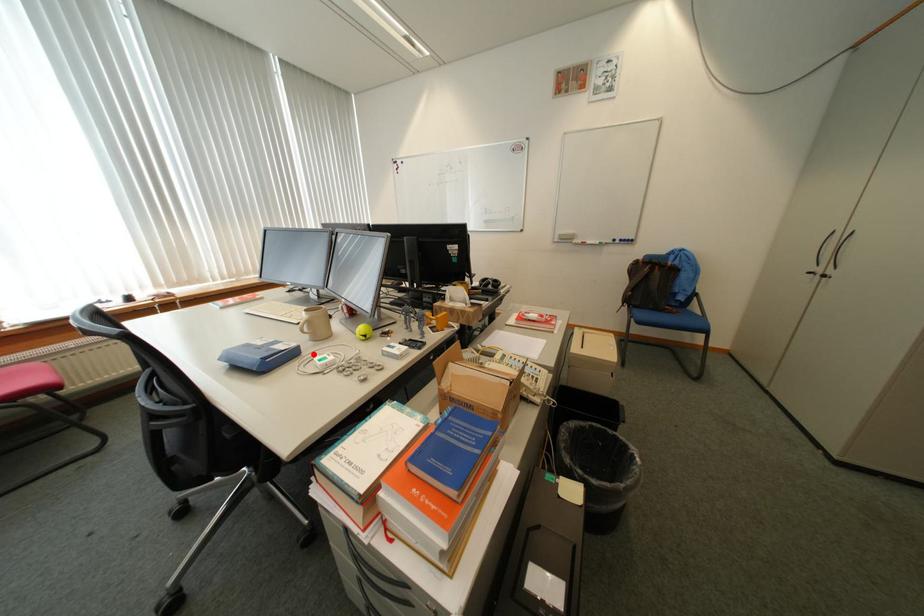
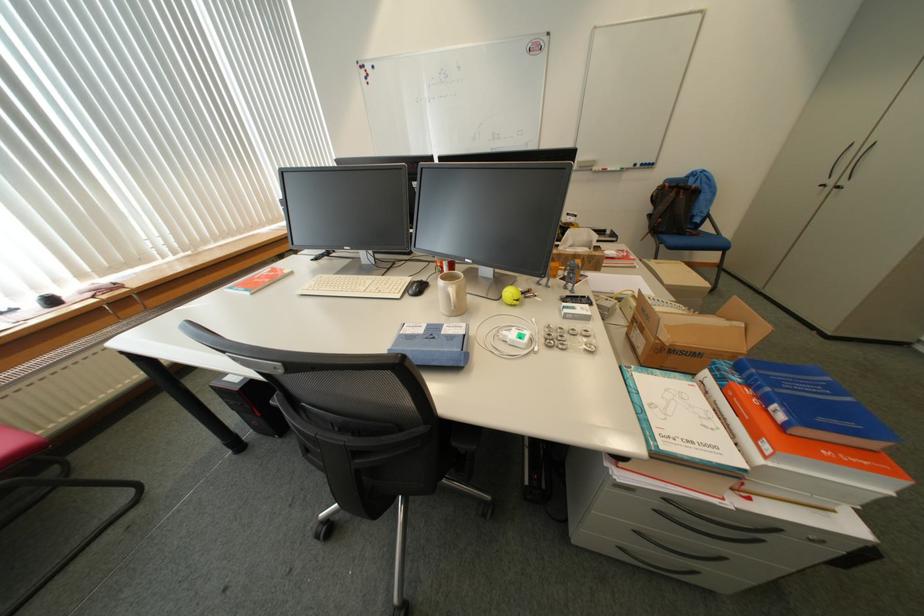
Find the pixel in the second image that matches the highlighted location in the first image.

(481, 334)